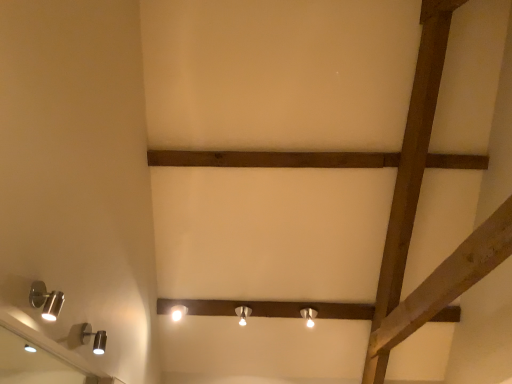
Question: Is silver metallic mirror at lower left closer to camera compared to satin silver spotlight at lower left, arranged as the fourth lamp when ordered from the bottom?

Choices:
 (A) no
 (B) yes

Answer: (B)

Question: Is silver metallic mirror at lower left at the left side of satin silver spotlight at lower left, arranged as the fourth lamp when ordered from the bottom?

Choices:
 (A) no
 (B) yes

Answer: (B)

Question: Are silver metallic mirror at lower left and satin silver spotlight at lower left, the 4th lamp in the back-to-front sequence, far apart?

Choices:
 (A) no
 (B) yes

Answer: (B)

Question: Does silver metallic mirror at lower left have a larger size compared to satin silver spotlight at lower left, arranged as the fourth lamp when ordered from the bottom?

Choices:
 (A) no
 (B) yes

Answer: (B)

Question: Is silver metallic mirror at lower left with satin silver spotlight at lower left, the second lamp from the left?

Choices:
 (A) yes
 (B) no

Answer: (B)

Question: From a real-world perspective, is silver metallic mirror at lower left physically below satin silver spotlight at lower left, the 4th lamp in the back-to-front sequence?

Choices:
 (A) yes
 (B) no

Answer: (A)

Question: Is white glossy lamp at center, positioned as the third lamp in right-to-left order, further to camera compared to brown wooden plank at center?

Choices:
 (A) yes
 (B) no

Answer: (A)

Question: Could you tell me if white glossy lamp at center, the third lamp when ordered from top to bottom, is turned towards brown wooden plank at center?

Choices:
 (A) yes
 (B) no

Answer: (B)

Question: Can you confirm if white glossy lamp at center, the third lamp when ordered from top to bottom, is thinner than brown wooden plank at center?

Choices:
 (A) yes
 (B) no

Answer: (B)

Question: Can you confirm if white glossy lamp at center, which appears as the third lamp when ordered from the bottom, is taller than brown wooden plank at center?

Choices:
 (A) yes
 (B) no

Answer: (A)

Question: From the image's perspective, would you say white glossy lamp at center, which is the 3th lamp in left-to-right order, is positioned over brown wooden plank at center?

Choices:
 (A) yes
 (B) no

Answer: (B)

Question: Is brown wooden plank at center located within white glossy lamp at center, acting as the fourth lamp starting from the front?

Choices:
 (A) yes
 (B) no

Answer: (B)

Question: Is white glossy lamp at center, acting as the fourth lamp starting from the front, positioned with its back to matte silver lamp at center, placed as the 5th lamp when sorted from top to bottom?

Choices:
 (A) no
 (B) yes

Answer: (A)